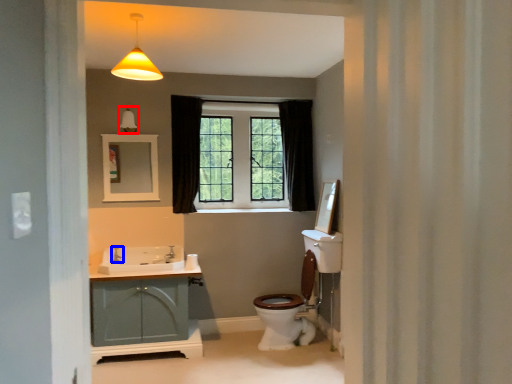
Question: Which object appears closest to the camera in this image, light fixture (highlighted by a red box) or faucet (highlighted by a blue box)?

Choices:
 (A) light fixture
 (B) faucet

Answer: (A)